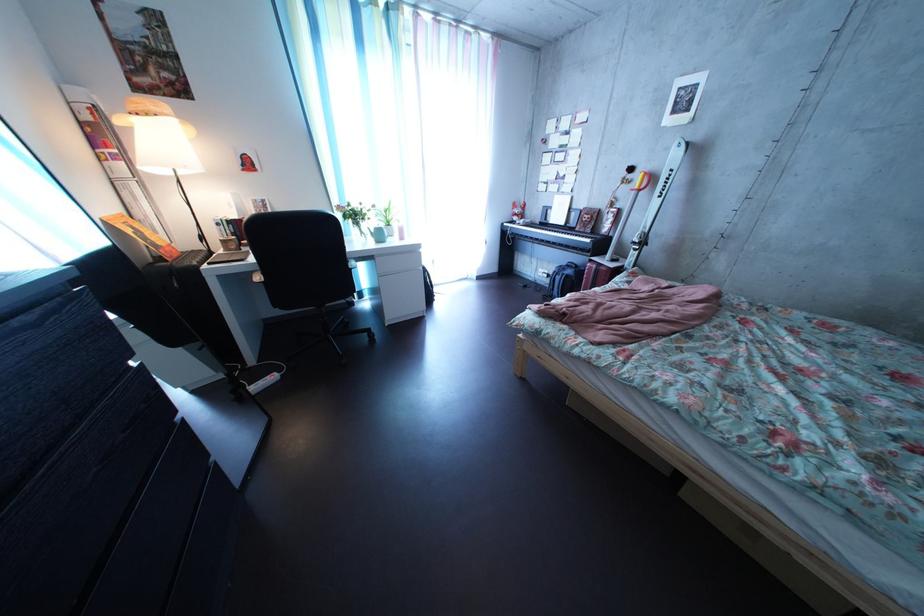
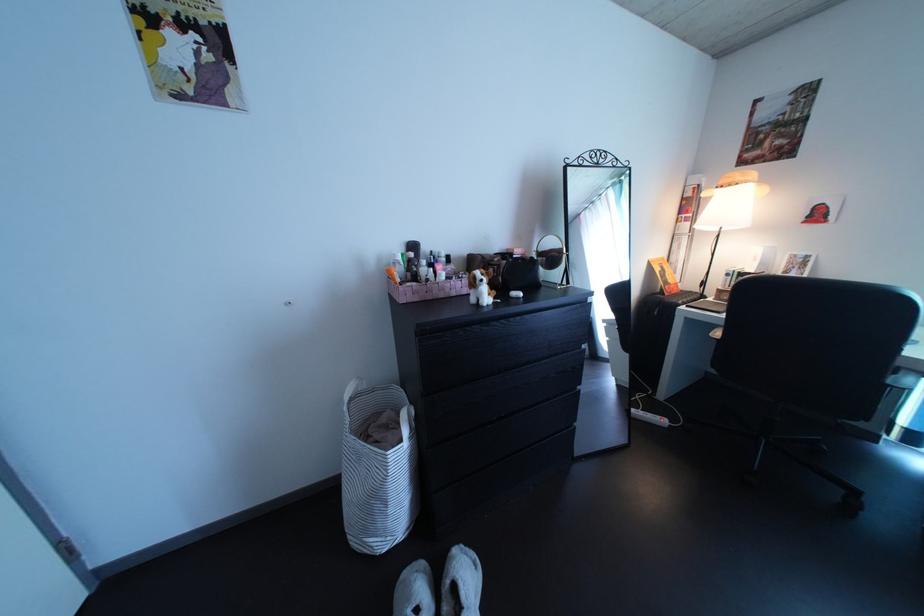
Based on the continuous images, in which direction is the camera rotating?

The rotation direction of the camera is left-down.